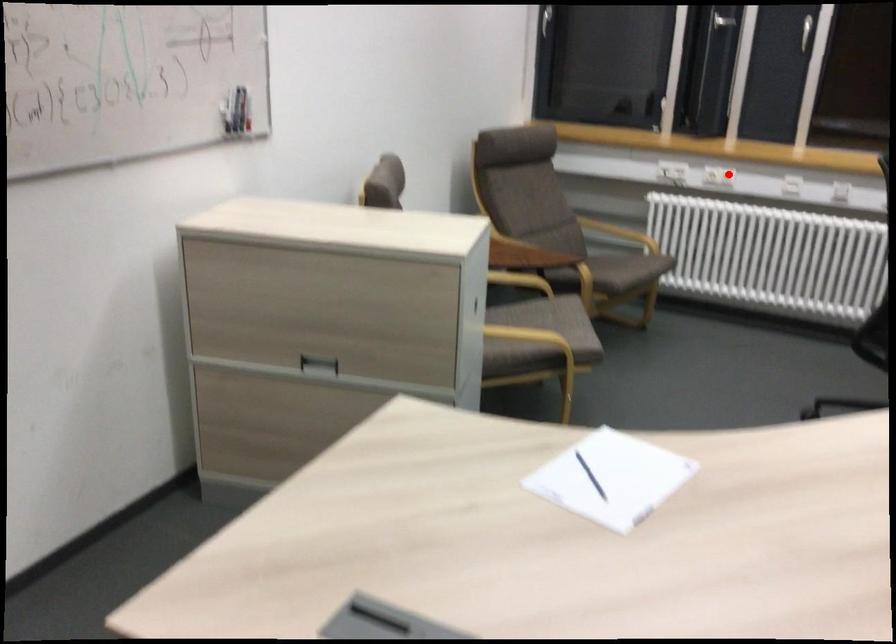
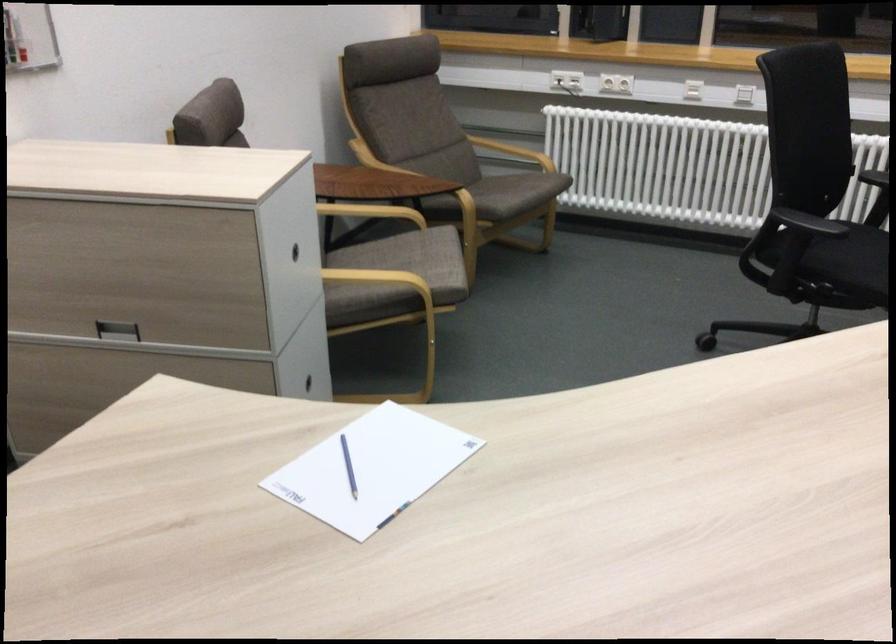
Find the pixel in the second image that matches the highlighted location in the first image.

(616, 82)